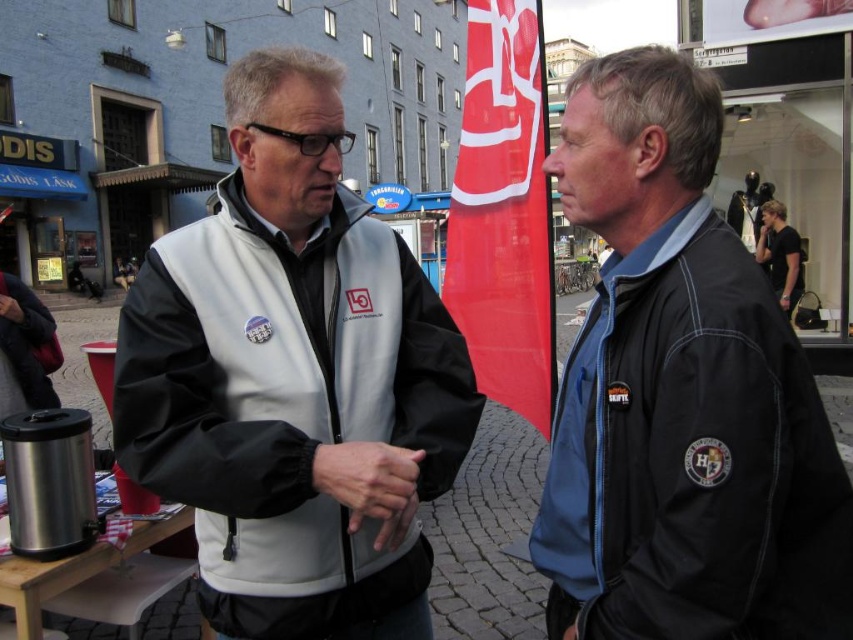
Which of these two, white matte jacket at center or black matte jacket at center, stands shorter?

With less height is black matte jacket at center.

Between point (312, 477) and point (691, 422), which one is positioned behind?

Point (312, 477)

Find the location of a particular element. This screenshot has width=853, height=640. white matte jacket at center is located at coordinates (294, 380).

Find the location of a particular element. The width and height of the screenshot is (853, 640). white matte jacket at center is located at coordinates (294, 380).